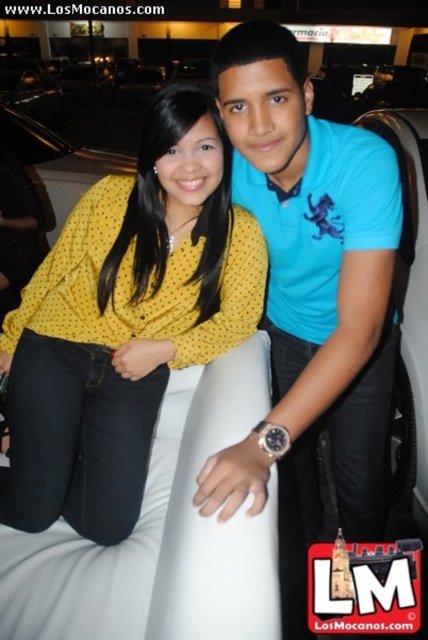
Question: From the image, what is the correct spatial relationship of yellow dotted shirt at center in relation to blue cotton shirt at center?

Choices:
 (A) below
 (B) above

Answer: (B)

Question: Which of the following is the farthest from the observer?

Choices:
 (A) blue cotton shirt at center
 (B) yellow dotted shirt at center

Answer: (B)

Question: Which object appears farthest from the camera in this image?

Choices:
 (A) yellow dotted shirt at center
 (B) blue cotton shirt at center

Answer: (A)

Question: Among these objects, which one is farthest from the camera?

Choices:
 (A) yellow dotted shirt at center
 (B) blue cotton shirt at center

Answer: (A)

Question: Can you confirm if yellow dotted shirt at center is smaller than blue cotton shirt at center?

Choices:
 (A) yes
 (B) no

Answer: (A)

Question: Can you confirm if yellow dotted shirt at center is positioned below blue cotton shirt at center?

Choices:
 (A) no
 (B) yes

Answer: (A)